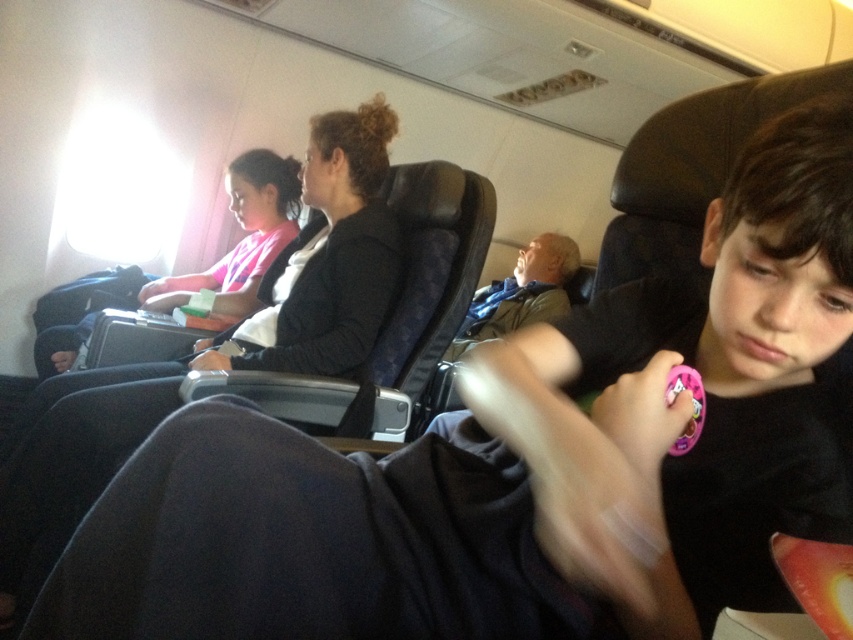
Find the location of a particular element. This screenshot has height=640, width=853. pink fabric shirt at left is located at coordinates (241, 240).

Can you confirm if pink fabric shirt at left is taller than pink plastic toy at lower right?

Indeed, pink fabric shirt at left has a greater height compared to pink plastic toy at lower right.

Does point (260, 205) come closer to viewer compared to point (685, 369)?

That is False.

Locate an element on the screen. This screenshot has height=640, width=853. pink fabric shirt at left is located at coordinates [241, 240].